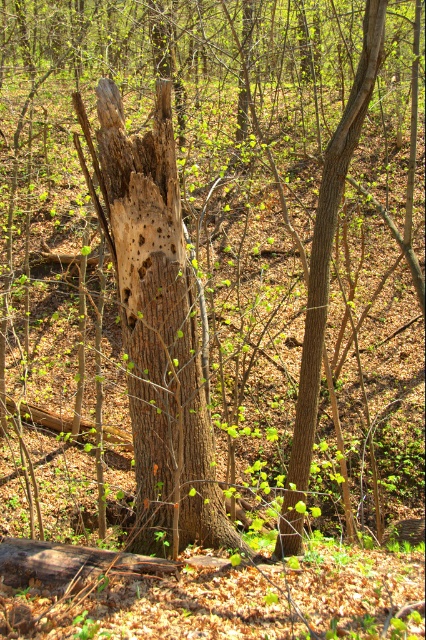
You are a hiker who has stumbled upon this woodland area. You notice a point marked at coordinates (158,330). What object is located at this specific point?

The brown rough bark tree trunk at center is located at point (158,330).

You are a photographer standing at the edge of the woodland scene. You want to take a closeup shot of the brown rough bark tree trunk at center. Given that your camera can focus clearly on objects within 10 feet, will you be able to capture a clear closeup without moving closer?

The brown rough bark tree trunk at center is 13.52 feet from the camera, which is beyond the 10 feet focus range. Therefore, you cannot capture a clear closeup without moving closer.